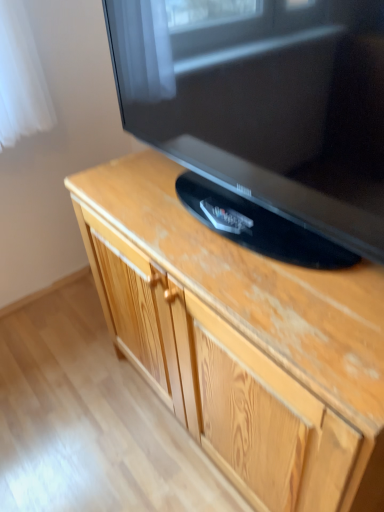
Question: Is matte black television at upper center thinner than wooden cabinet at center?

Choices:
 (A) yes
 (B) no

Answer: (A)

Question: Is matte black television at upper center positioned beyond the bounds of wooden cabinet at center?

Choices:
 (A) yes
 (B) no

Answer: (A)

Question: Can you confirm if matte black television at upper center is positioned to the right of wooden cabinet at center?

Choices:
 (A) yes
 (B) no

Answer: (B)

Question: Does matte black television at upper center lie in front of wooden cabinet at center?

Choices:
 (A) no
 (B) yes

Answer: (B)

Question: Would you consider matte black television at upper center to be distant from wooden cabinet at center?

Choices:
 (A) no
 (B) yes

Answer: (A)

Question: Is matte black television at upper center in contact with wooden cabinet at center?

Choices:
 (A) no
 (B) yes

Answer: (A)

Question: From the image's perspective, is wooden cabinet at center beneath matte black television at upper center?

Choices:
 (A) yes
 (B) no

Answer: (A)

Question: Is matte black television at upper center located within wooden cabinet at center?

Choices:
 (A) no
 (B) yes

Answer: (A)

Question: Is wooden cabinet at center taller than matte black television at upper center?

Choices:
 (A) no
 (B) yes

Answer: (B)

Question: Is wooden cabinet at center facing towards matte black television at upper center?

Choices:
 (A) yes
 (B) no

Answer: (B)

Question: Does wooden cabinet at center lie behind matte black television at upper center?

Choices:
 (A) no
 (B) yes

Answer: (B)

Question: From the image's perspective, does wooden cabinet at center appear higher than matte black television at upper center?

Choices:
 (A) yes
 (B) no

Answer: (B)

Question: From the image's perspective, is wooden cabinet at center located above or below matte black television at upper center?

Choices:
 (A) above
 (B) below

Answer: (B)